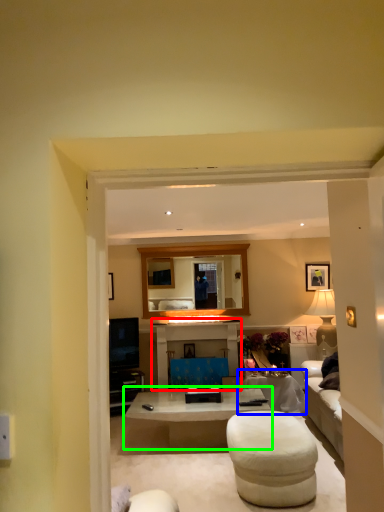
Question: Which object is positioned closest to entertainment center (highlighted by a red box)? Select from table (highlighted by a blue box) and coffee table (highlighted by a green box).

Choices:
 (A) table
 (B) coffee table

Answer: (A)